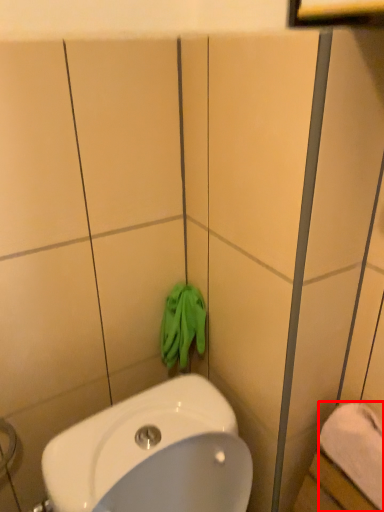
Question: From the image's perspective, considering the relative positions of towel/napkin (annotated by the red box) and bath towel in the image provided, where is towel/napkin (annotated by the red box) located with respect to the staircase?

Choices:
 (A) below
 (B) above

Answer: (A)